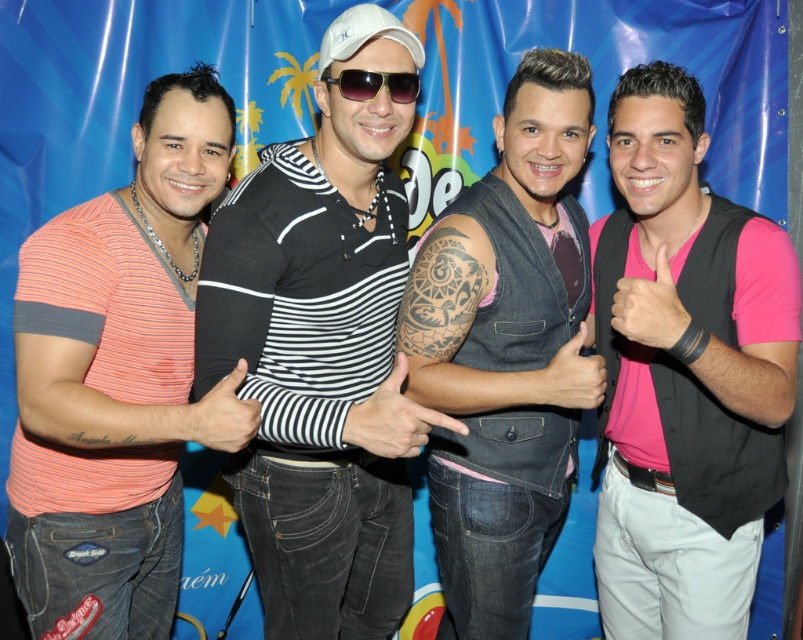
Question: Is black striped shirt at center to the left of denim vest at center from the viewer's perspective?

Choices:
 (A) yes
 (B) no

Answer: (A)

Question: Which point is closer to the camera taking this photo?

Choices:
 (A) (386, 296)
 (B) (66, 541)

Answer: (B)

Question: Is matte coral striped shirt at left to the right of sunglasses at center from the viewer's perspective?

Choices:
 (A) no
 (B) yes

Answer: (A)

Question: Is pink matte vest at right positioned behind denim vest at center?

Choices:
 (A) no
 (B) yes

Answer: (A)

Question: Which point is farther to the camera?

Choices:
 (A) (31, 470)
 (B) (337, 76)
 (C) (437, 369)
 (D) (312, 172)

Answer: (C)

Question: Which of the following is the closest to the observer?

Choices:
 (A) pink matte vest at right
 (B) sunglasses at center
 (C) matte coral striped shirt at left
 (D) denim vest at center

Answer: (C)